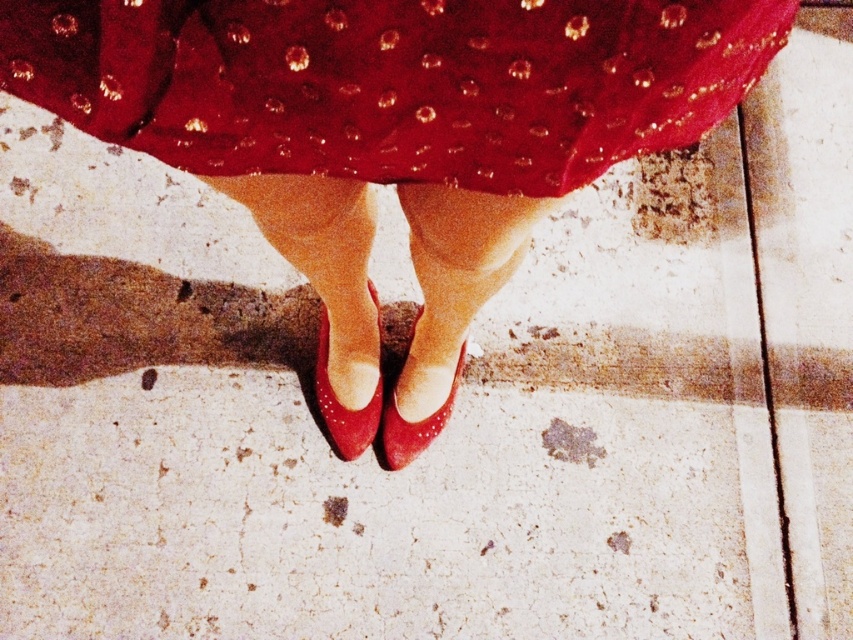
Question: Which object is positioned closest to the shiny patent leather shoes at center?

Choices:
 (A) shiny red heels at center
 (B) shiny leather sandal at center
 (C) shiny red fabric at center

Answer: (C)

Question: Which object is the farthest from the shiny red fabric at center?

Choices:
 (A) shiny leather sandal at center
 (B) shiny patent leather shoes at center
 (C) shiny red heels at center

Answer: (C)

Question: Is shiny patent leather shoes at center smaller than shiny red heels at center?

Choices:
 (A) no
 (B) yes

Answer: (A)

Question: Does shiny red fabric at center have a greater width compared to shiny leather sandal at center?

Choices:
 (A) no
 (B) yes

Answer: (B)

Question: Does shiny patent leather shoes at center have a greater width compared to shiny red fabric at center?

Choices:
 (A) yes
 (B) no

Answer: (A)

Question: Among these objects, which one is farthest from the camera?

Choices:
 (A) shiny leather sandal at center
 (B) shiny red heels at center
 (C) shiny patent leather shoes at center

Answer: (A)